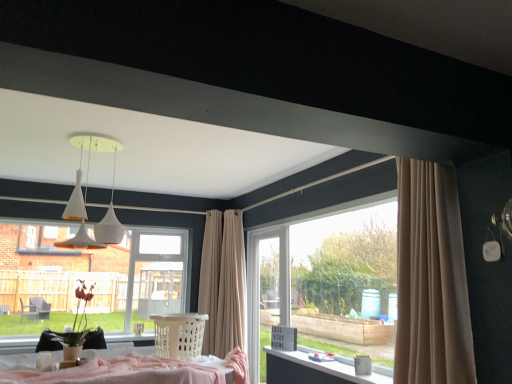
Identify the location of vacant area on top of white matte pendant lights at upper center (from a real-world perspective). This screenshot has height=384, width=512. click(x=109, y=144).